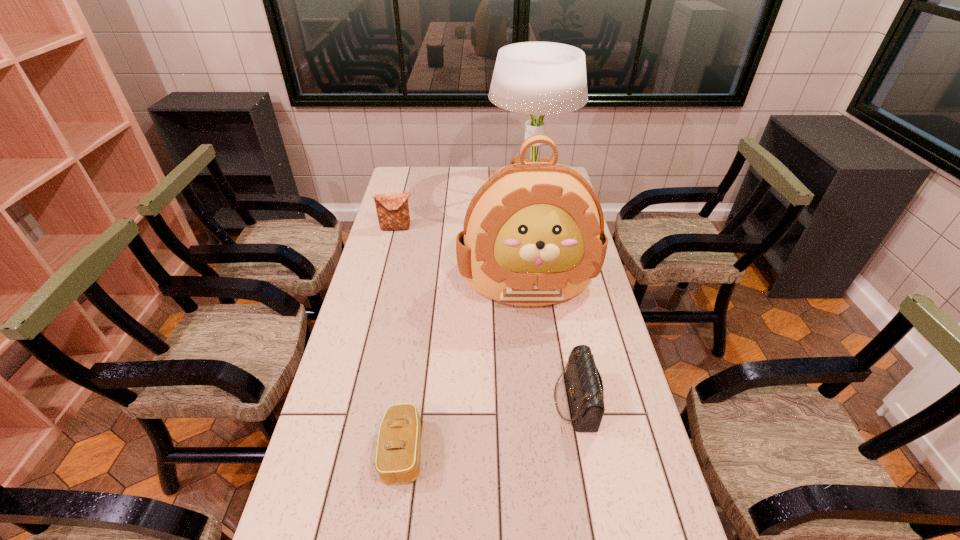
The width and height of the screenshot is (960, 540). Identify the location of free space in the image that satisfies the following two spatial constraints: 1. on the front-facing side of the farthest object; 2. on the open side of the third tallest object. [x=536, y=228].

Find the location of `free spot that satisfies the following two spatial constraints: 1. on the front-facing side of the farthest object; 2. on the open side of the leftmost object`. free spot that satisfies the following two spatial constraints: 1. on the front-facing side of the farthest object; 2. on the open side of the leftmost object is located at coordinates pos(536,228).

Locate an element on the screen. This screenshot has width=960, height=540. free point that satisfies the following two spatial constraints: 1. on the front-facing side of the farthest object; 2. on the front-facing side of the third nearest object is located at coordinates (544, 282).